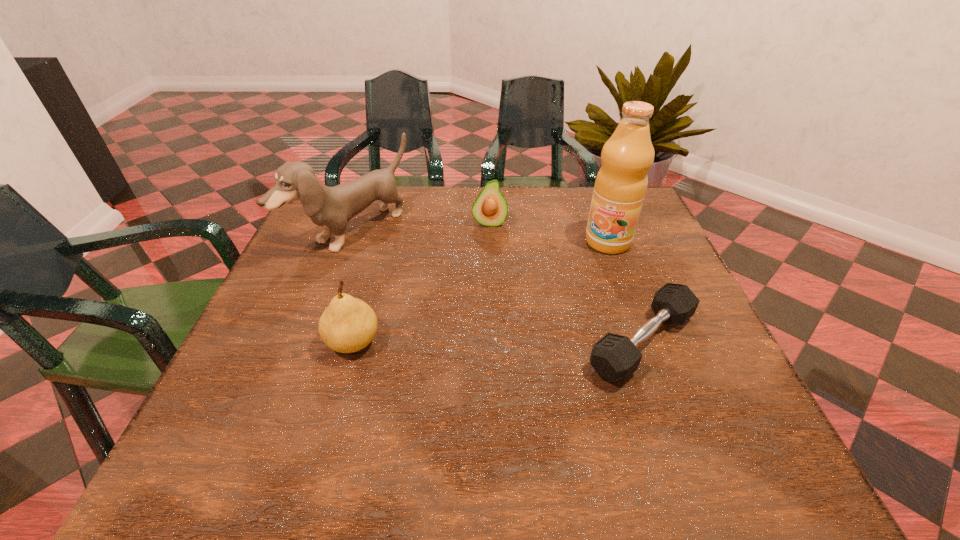
Image resolution: width=960 pixels, height=540 pixels. Identify the location of vacant area that lies between the pear and the dumbbell. (497, 342).

Image resolution: width=960 pixels, height=540 pixels. Identify the location of free space that is in between the pear and the tallest object. (481, 292).

This screenshot has width=960, height=540. Identify the location of vacant space in between the avocado and the dumbbell. (565, 282).

Identify which object is located as the fourth nearest to the tallest object. Please provide its 2D coordinates. Your answer should be formatted as a tuple, i.e. [(x, y)], where the tuple contains the x and y coordinates of a point satisfying the conditions above.

[(348, 324)]

In order to click on the fourth closest object to the tallest object in this screenshot , I will do `click(348, 324)`.

You are a GUI agent. You are given a task and a screenshot of the screen. Output one action in this format:
    pyautogui.click(x=<x>, y=<y>)
    Task: Click on the free spot that satisfies the following two spatial constraints: 1. on the front side of the pear; 2. on the right side of the fourth shortest object
    This screenshot has width=960, height=540.
    Given the screenshot: What is the action you would take?
    pyautogui.click(x=312, y=342)